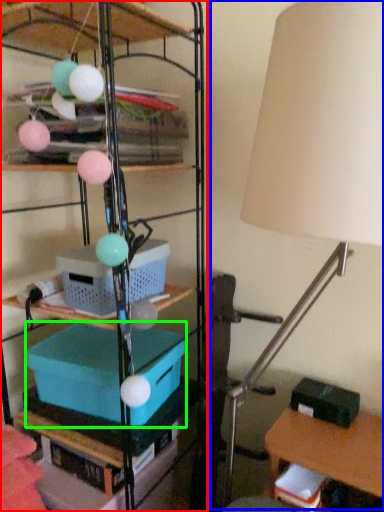
Question: Which is farther away from shelf (highlighted by a red box)? lamp (highlighted by a blue box) or storage box (highlighted by a green box)?

Choices:
 (A) lamp
 (B) storage box

Answer: (A)